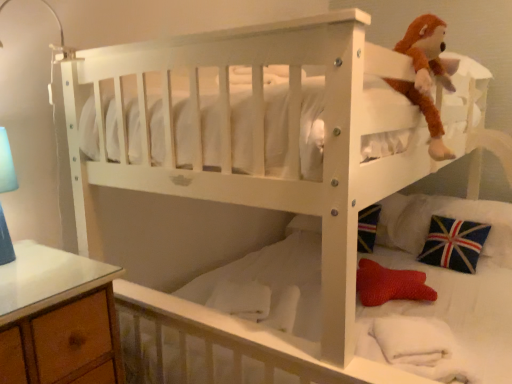
Measure the distance between union jack fabric pillow at lower right and camera.

union jack fabric pillow at lower right is 6.65 feet from camera.

The width and height of the screenshot is (512, 384). What do you see at coordinates (444, 216) in the screenshot? I see `union jack fabric pillow at lower right` at bounding box center [444, 216].

This screenshot has width=512, height=384. Find the location of `union jack fabric pillow at lower right`. union jack fabric pillow at lower right is located at coordinates (444, 216).

What is the approximate width of union jack fabric pillow at lower right?

The width of union jack fabric pillow at lower right is 18.10 inches.

The height and width of the screenshot is (384, 512). Describe the element at coordinates (426, 76) in the screenshot. I see `brown plush toy at upper right` at that location.

The width and height of the screenshot is (512, 384). Find the location of `brown plush toy at upper right`. brown plush toy at upper right is located at coordinates (426, 76).

Image resolution: width=512 pixels, height=384 pixels. I want to click on union jack fabric pillow at lower right, so click(x=444, y=216).

Which is more to the left, union jack fabric pillow at lower right or brown plush toy at upper right?

From the viewer's perspective, brown plush toy at upper right appears more on the left side.

Relative to brown plush toy at upper right, is union jack fabric pillow at lower right in front or behind?

Clearly, union jack fabric pillow at lower right is behind brown plush toy at upper right.

Which point is more distant from viewer, (410, 233) or (421, 29)?

Positioned behind is point (410, 233).

From the image's perspective, is union jack fabric pillow at lower right beneath brown plush toy at upper right?

Yes.

From a real-world perspective, is union jack fabric pillow at lower right above or below brown plush toy at upper right?

From a real-world perspective, union jack fabric pillow at lower right is physically below brown plush toy at upper right.

Can you confirm if union jack fabric pillow at lower right is wider than brown plush toy at upper right?

Correct, the width of union jack fabric pillow at lower right exceeds that of brown plush toy at upper right.

Can you confirm if union jack fabric pillow at lower right is taller than brown plush toy at upper right?

Incorrect, the height of union jack fabric pillow at lower right is not larger of that of brown plush toy at upper right.

Is union jack fabric pillow at lower right bigger or smaller than brown plush toy at upper right?

union jack fabric pillow at lower right is bigger than brown plush toy at upper right.

Is union jack fabric pillow at lower right positioned beyond the bounds of brown plush toy at upper right?

Indeed, union jack fabric pillow at lower right is completely outside brown plush toy at upper right.

Is union jack fabric pillow at lower right beside brown plush toy at upper right?

union jack fabric pillow at lower right and brown plush toy at upper right are clearly separated.

Is union jack fabric pillow at lower right oriented away from brown plush toy at upper right?

No, union jack fabric pillow at lower right's orientation is not away from brown plush toy at upper right.

How different are the orientations of union jack fabric pillow at lower right and brown plush toy at upper right in degrees?

The facing directions of union jack fabric pillow at lower right and brown plush toy at upper right are 86.9 degrees apart.

How distant is union jack fabric pillow at lower right from brown plush toy at upper right?

union jack fabric pillow at lower right is 32.37 inches away from brown plush toy at upper right.

Locate an element on the screen. The height and width of the screenshot is (384, 512). pillow that appears below the brown plush toy at upper right (from a real-world perspective) is located at coordinates (444, 216).

Does brown plush toy at upper right appear on the left side of union jack fabric pillow at lower right?

Indeed, brown plush toy at upper right is positioned on the left side of union jack fabric pillow at lower right.

Is the position of brown plush toy at upper right more distant than that of union jack fabric pillow at lower right?

No, brown plush toy at upper right is in front of union jack fabric pillow at lower right.

Does point (421, 30) come in front of point (426, 230)?

Yes.

From the image's perspective, is brown plush toy at upper right over union jack fabric pillow at lower right?

Indeed, from the image's perspective, brown plush toy at upper right is shown above union jack fabric pillow at lower right.

From a real-world perspective, is brown plush toy at upper right above or below union jack fabric pillow at lower right?

From a real-world perspective, brown plush toy at upper right is physically above union jack fabric pillow at lower right.

Considering the relative sizes of brown plush toy at upper right and union jack fabric pillow at lower right in the image provided, is brown plush toy at upper right wider than union jack fabric pillow at lower right?

In fact, brown plush toy at upper right might be narrower than union jack fabric pillow at lower right.

Considering the sizes of brown plush toy at upper right and union jack fabric pillow at lower right in the image, is brown plush toy at upper right taller or shorter than union jack fabric pillow at lower right?

Considering their sizes, brown plush toy at upper right has more height than union jack fabric pillow at lower right.

Is brown plush toy at upper right bigger or smaller than union jack fabric pillow at lower right?

Considering their sizes, brown plush toy at upper right takes up less space than union jack fabric pillow at lower right.

From the picture: Is brown plush toy at upper right positioned beyond the bounds of union jack fabric pillow at lower right?

brown plush toy at upper right is positioned outside union jack fabric pillow at lower right.

Is brown plush toy at upper right with union jack fabric pillow at lower right?

No, brown plush toy at upper right is not with union jack fabric pillow at lower right.

Is brown plush toy at upper right oriented away from union jack fabric pillow at lower right?

No, brown plush toy at upper right is not facing the opposite direction of union jack fabric pillow at lower right.

How different are the orientations of brown plush toy at upper right and union jack fabric pillow at lower right in degrees?

There is a 86.9-degree angle between the facing directions of brown plush toy at upper right and union jack fabric pillow at lower right.

In the image, there is a brown plush toy at upper right. At what (x,y) coordinates should I click in order to perform the action: click on pillow below it (from a real-world perspective). Please return your answer as a coordinate pair (x, y). Looking at the image, I should click on (x=444, y=216).

Find the location of a particular element. The width and height of the screenshot is (512, 384). toy that is on the left side of union jack fabric pillow at lower right is located at coordinates (426, 76).

Where is `pillow that is on the right side of brown plush toy at upper right`? This screenshot has height=384, width=512. pillow that is on the right side of brown plush toy at upper right is located at coordinates (444, 216).